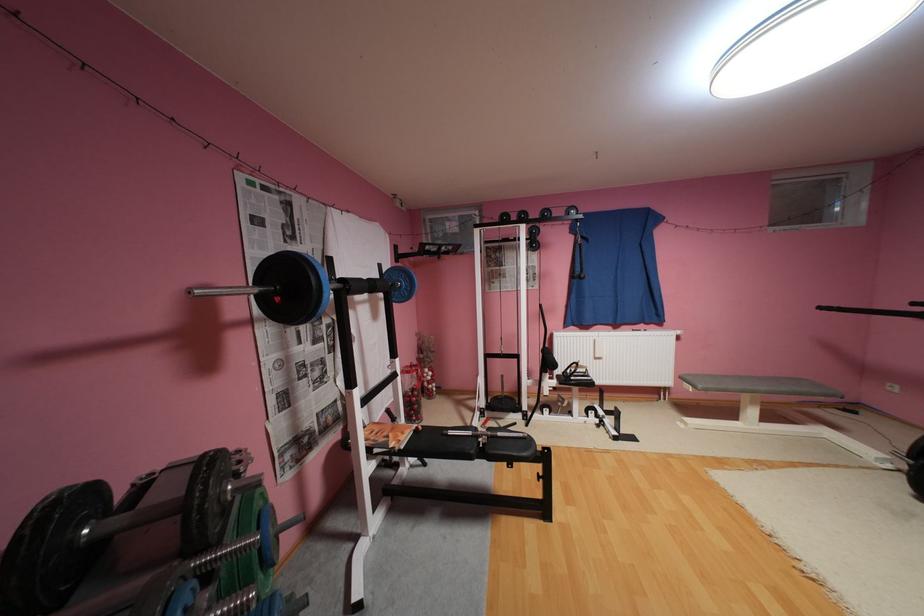
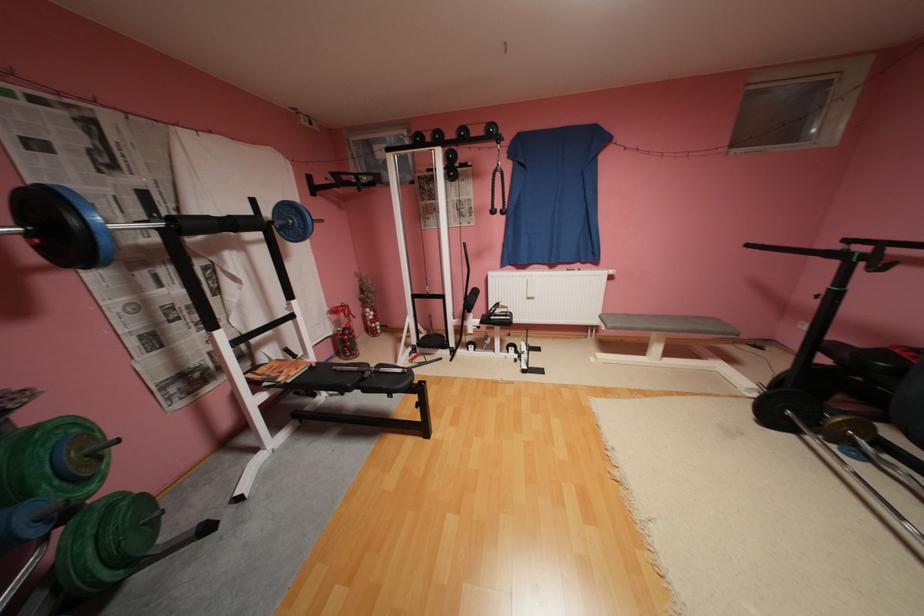
Find the pixel in the second image that matches [322,283] in the first image.

(82, 222)